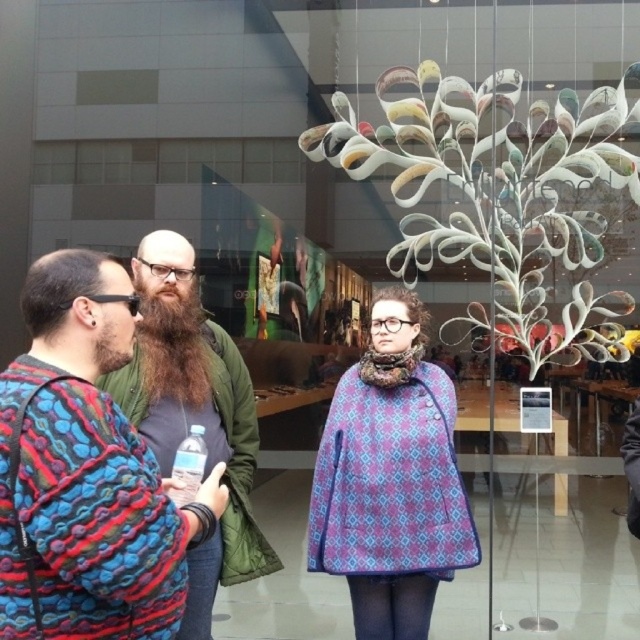
The width and height of the screenshot is (640, 640). What do you see at coordinates (172, 346) in the screenshot? I see `brownwoodybeard at center` at bounding box center [172, 346].

Between point (163, 340) and point (202, 470), which one is positioned behind?

Positioned behind is point (163, 340).

What do you see at coordinates (172, 346) in the screenshot? I see `brownwoodybeard at center` at bounding box center [172, 346].

At what (x,y) coordinates should I click in order to perform the action: click on brownwoodybeard at center. Please return your answer as a coordinate pair (x, y). The image size is (640, 640). Looking at the image, I should click on (172, 346).

Between point (100, 332) and point (381, 605), which one is positioned behind?

The point (381, 605) is more distant.

Where is `multicolored knitted sweater at left`? multicolored knitted sweater at left is located at coordinates (86, 474).

The height and width of the screenshot is (640, 640). In order to click on multicolored knitted sweater at left in this screenshot , I will do `click(86, 474)`.

Identify the location of multicolored knitted sweater at left. The width and height of the screenshot is (640, 640). (86, 474).

Which is below, multicolored knitted sweater at left or clear plastic bottle at center?

clear plastic bottle at center

Identify the location of multicolored knitted sweater at left. This screenshot has width=640, height=640. (86, 474).